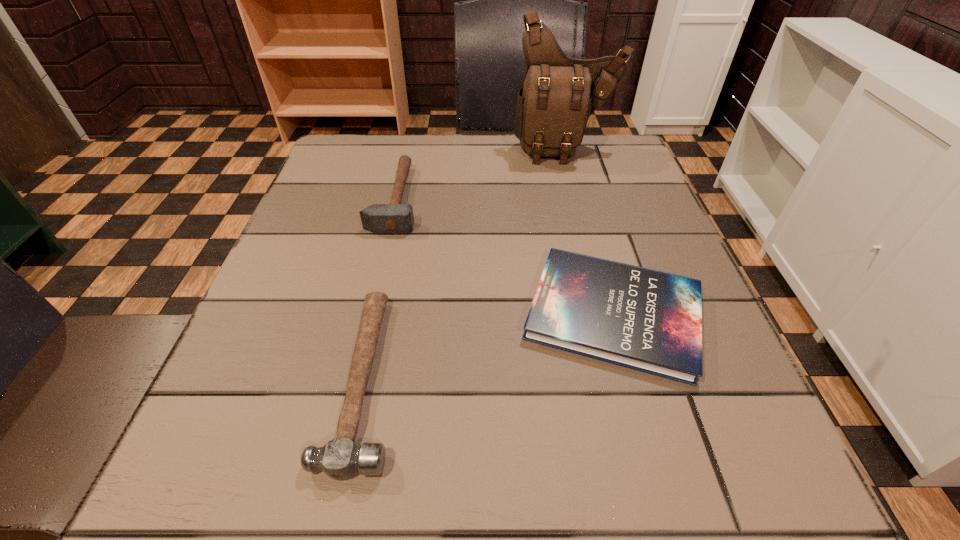
Locate an element on the screen. The image size is (960, 540). free spot at the near edge of the desktop is located at coordinates (619, 476).

Identify the location of vacant region at the left edge. (324, 238).

In the image, there is a desktop. Where is `vacant region at the right edge`? vacant region at the right edge is located at coordinates (703, 364).

Find the location of a particular element. This screenshot has height=540, width=960. free space at the far left corner of the desktop is located at coordinates (348, 171).

Find the location of a particular element. Image resolution: width=960 pixels, height=540 pixels. vacant area at the near left corner is located at coordinates (204, 518).

This screenshot has width=960, height=540. In the image, there is a desktop. Identify the location of vacant space at the far right corner. (603, 162).

The image size is (960, 540). Find the location of `free space between the farther hammer and the hardback book`. free space between the farther hammer and the hardback book is located at coordinates (505, 256).

Locate an element on the screen. Image resolution: width=960 pixels, height=540 pixels. free space between the second farthest object and the hardback book is located at coordinates (505, 256).

Find the location of a particular element. The width and height of the screenshot is (960, 540). free point between the shorter hammer and the second tallest object is located at coordinates (380, 288).

Identify the location of vacant area that lies between the hardback book and the third nearest object. The height and width of the screenshot is (540, 960). (505, 256).